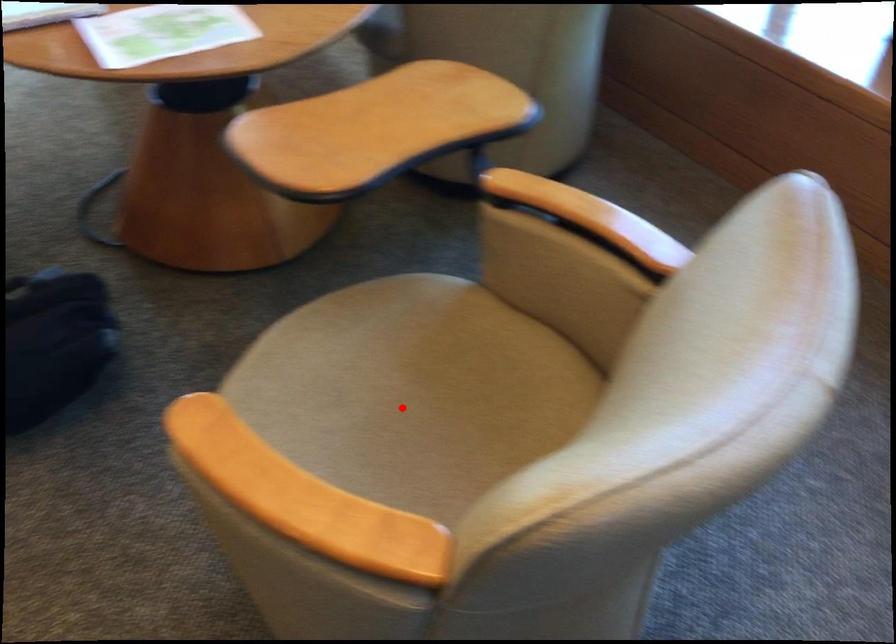
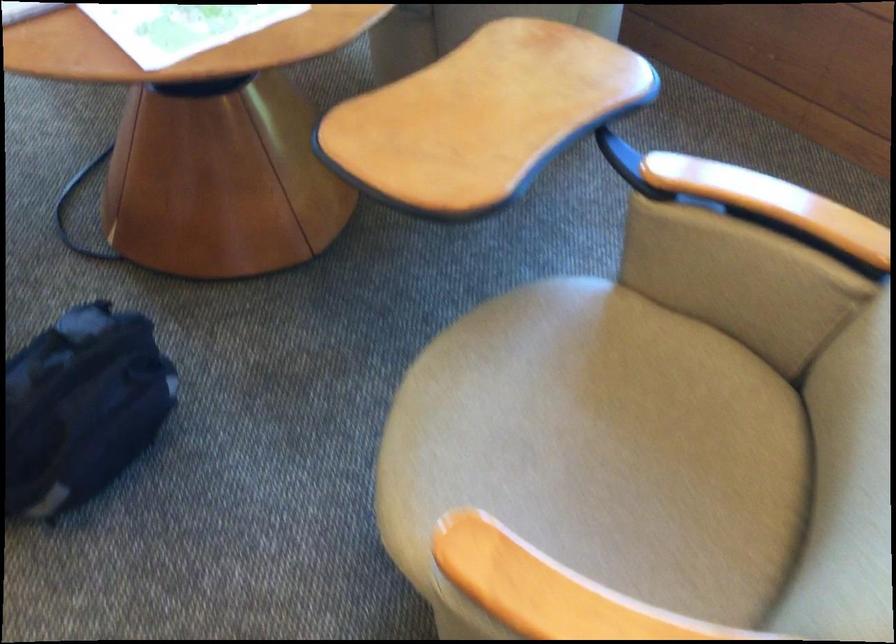
Question: I am providing you with two images of the same scene from different viewpoints. In image1, a red point is highlighted. Considering the same 3D point in image2, which of the following is correct?

Choices:
 (A) It is closer
 (B) It is farther

Answer: (A)